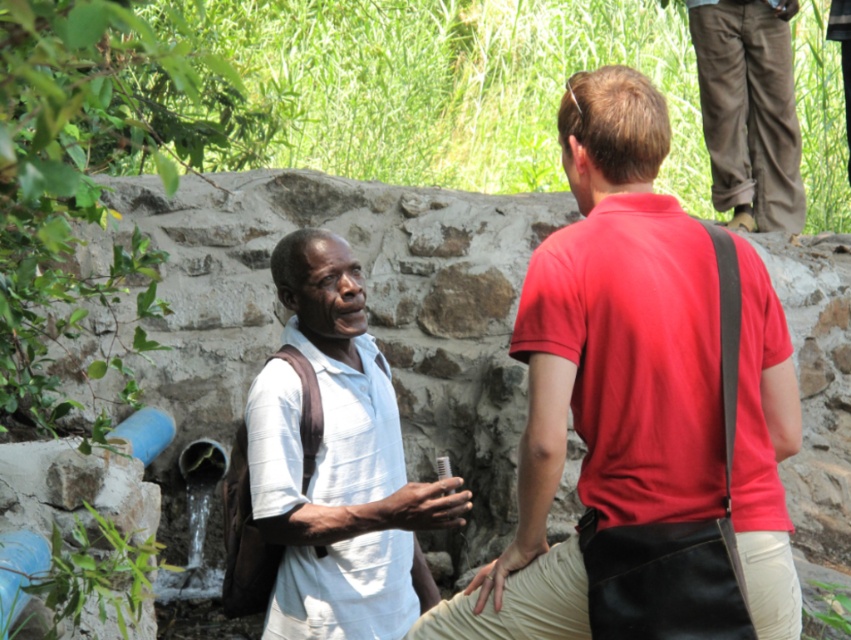
What is the color of the shirt at the point with coordinates (x=604, y=365)?

The point at coordinates (x=604, y=365) is on a matte red shirt at center, so the color is red.

You are standing at the origin point in the image. Which of the two points, point (657,396) or point (344,538), is closer to you?

Point (657,396) is in front of point (344,538), so it is closer to you.